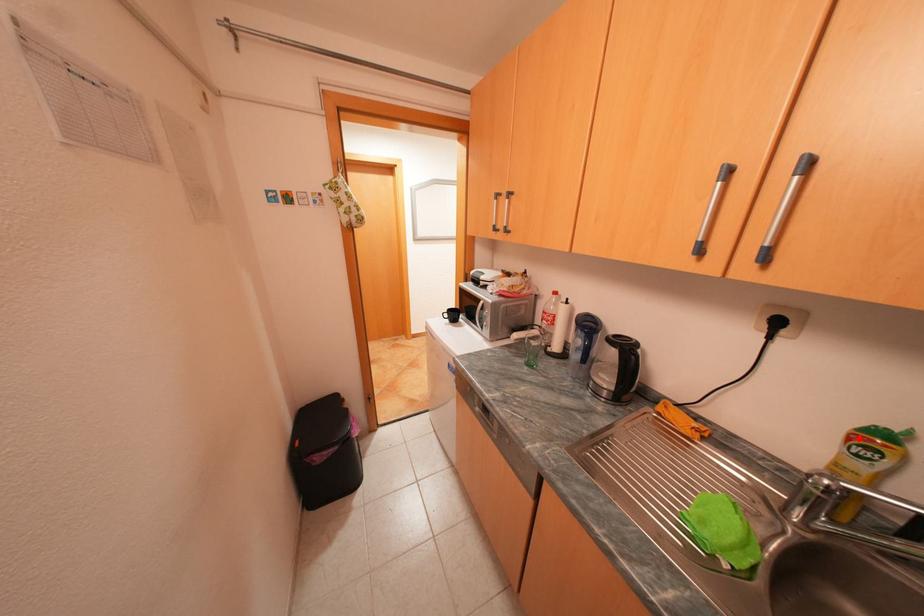
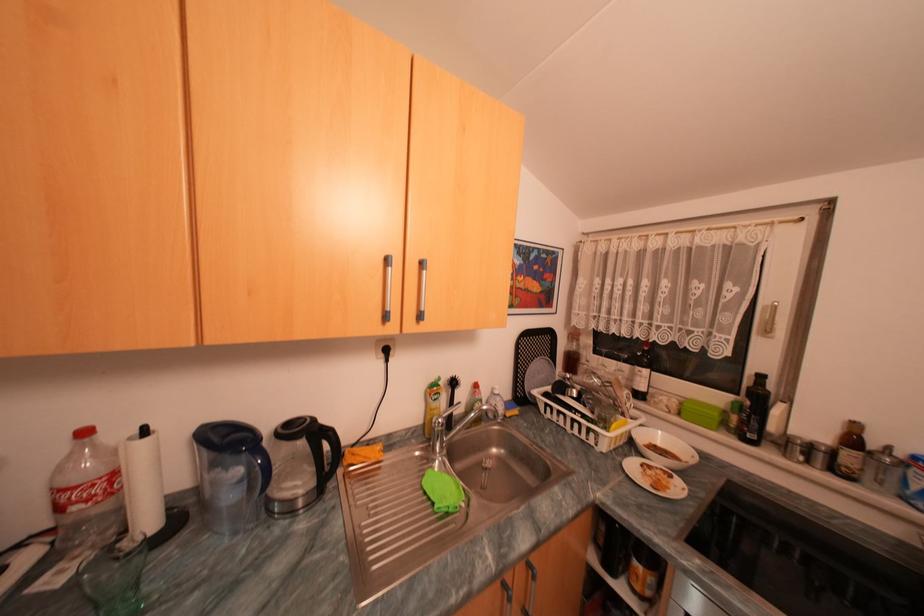
The point at the highlighted location is marked in the first image. Where is the corresponding point in the second image?

(440, 394)